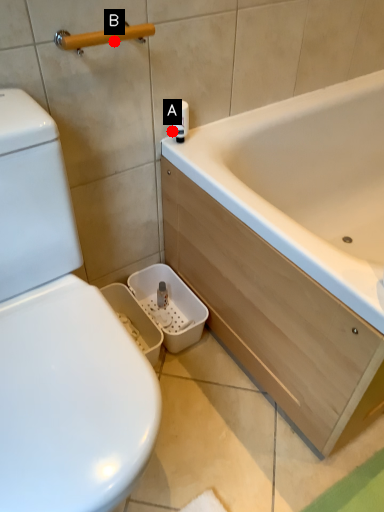
Question: Two points are circled on the image, labeled by A and B beside each circle. Among these points, which one is nearest to the camera?

Choices:
 (A) A is closer
 (B) B is closer

Answer: (B)